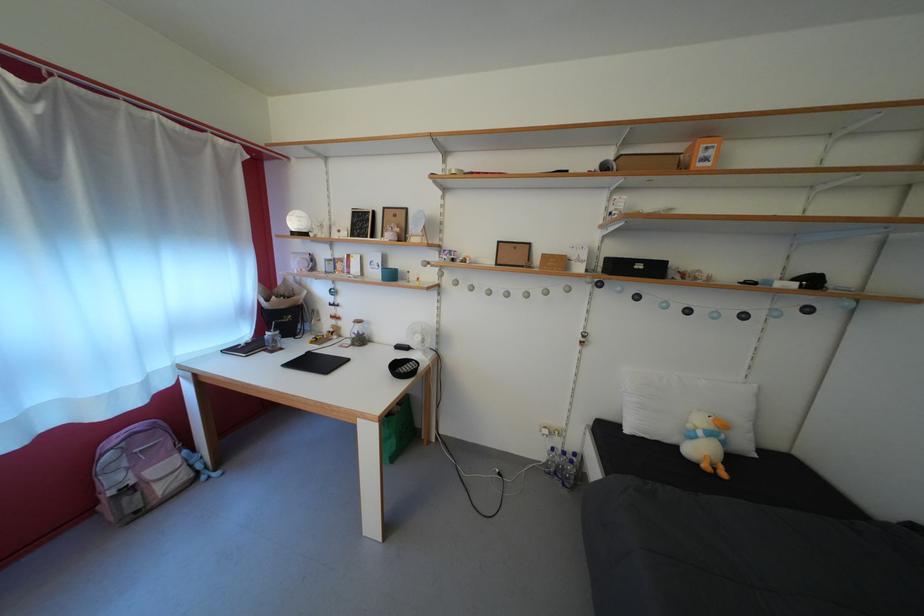
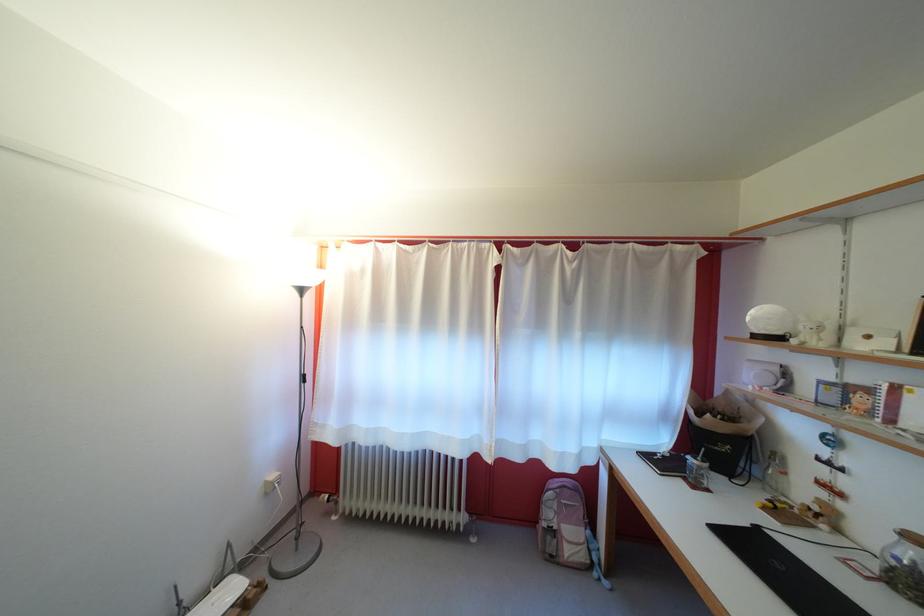
Find the pixel in the second image that matches pixel 343 267 in the first image.

(855, 395)